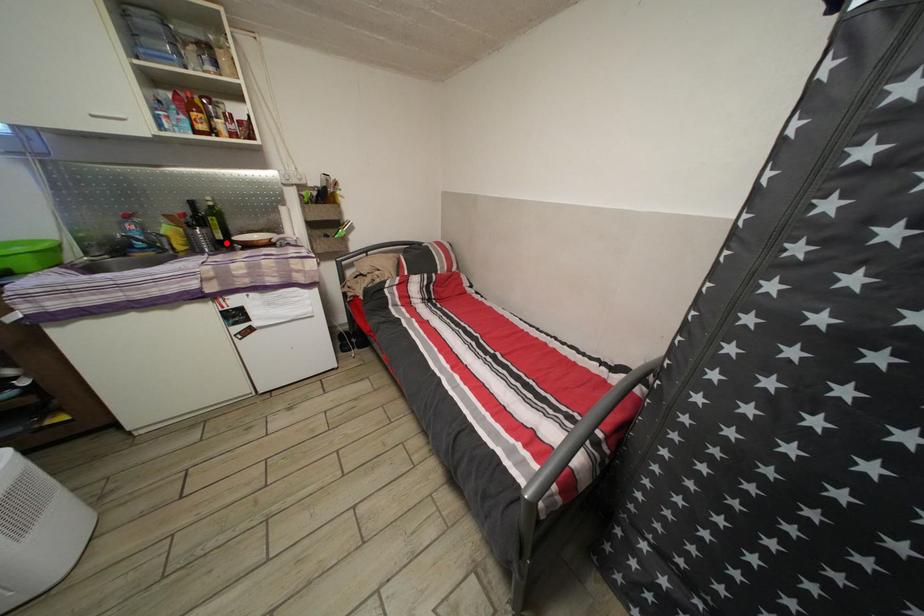
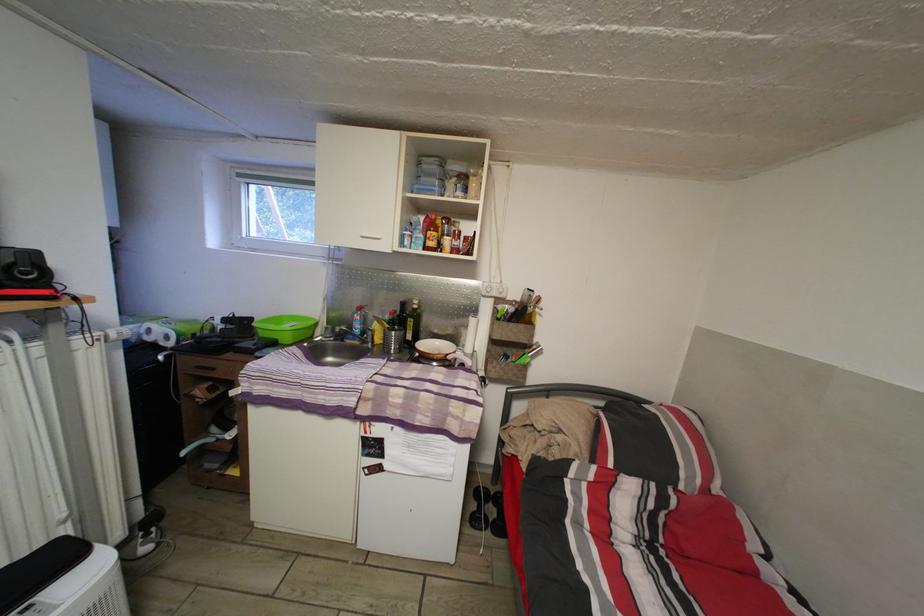
In the second image, find the point that corresponds to the highlighted location in the first image.

(417, 344)